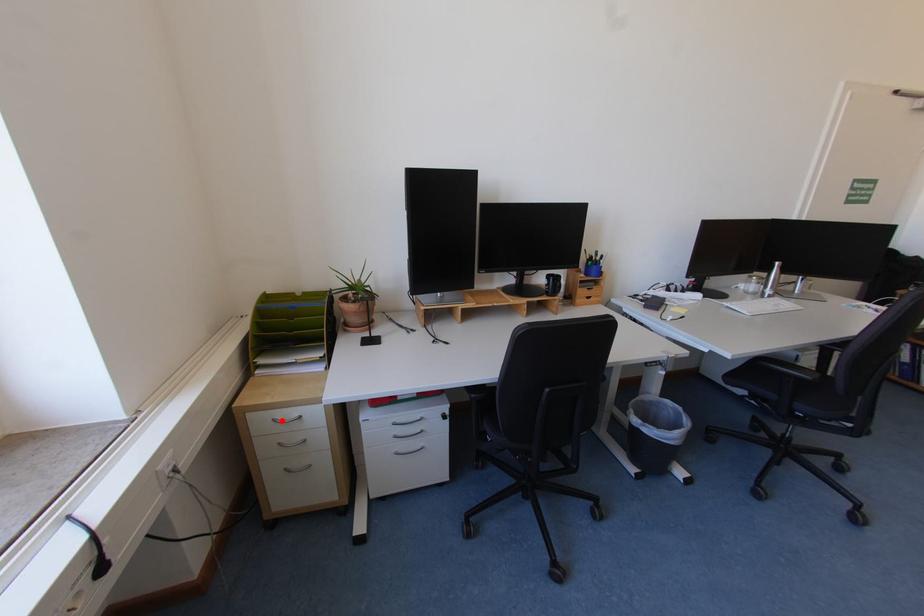
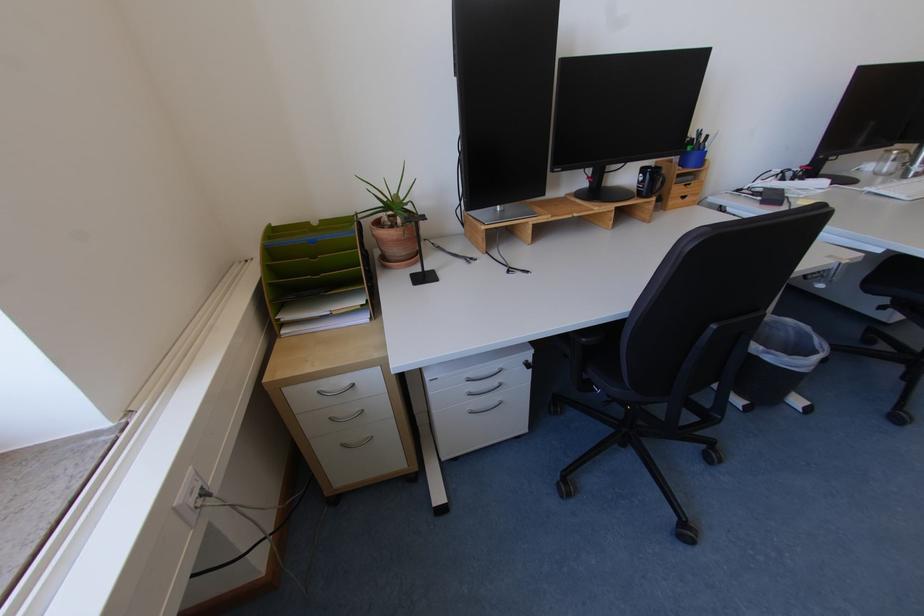
Locate, in the second image, the point that corresponds to the highlighted location in the first image.

(327, 392)